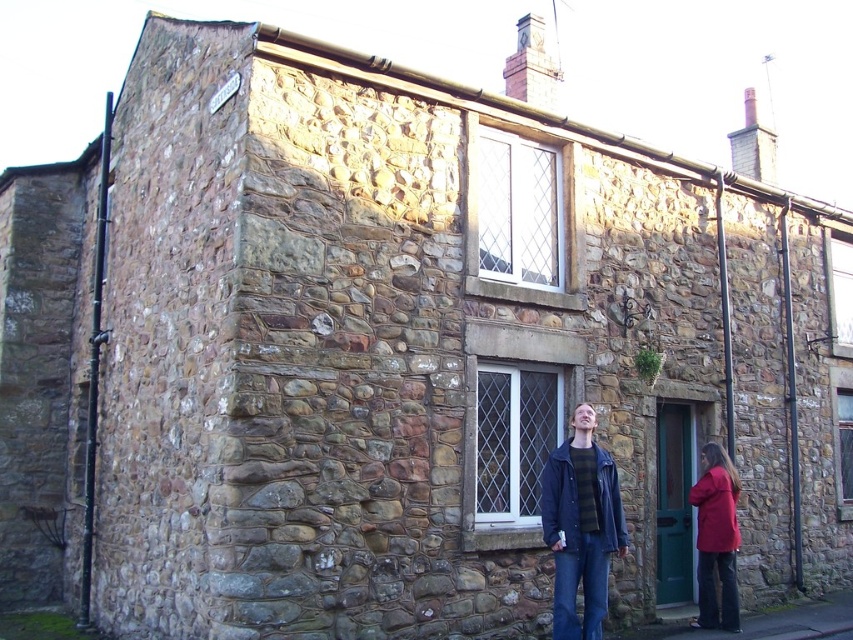
You are standing in front of the stone building and see the dark blue leather jacket at lower center and the red fabric coat at lower right. Which item is closer to you?

The dark blue leather jacket at lower center is closer to you because it is in front of the red fabric coat at lower right.

You are a delivery person trying to place a large package on the ground in front of the quaint stone building. You see the dark blue leather jacket at lower center and the red fabric coat at lower right. Which object should you move to make space for the package?

You should move the dark blue leather jacket at lower center because it might be wider than the red fabric coat at lower right, so moving it would create more space for the package.

You are standing in front of the stone building and see a dark blue leather jacket at lower center and a red fabric coat at lower right. Which item is located to the left of the other?

The dark blue leather jacket at lower center is positioned on the left side of red fabric coat at lower right.